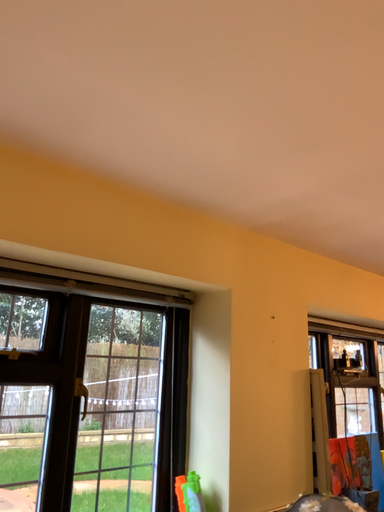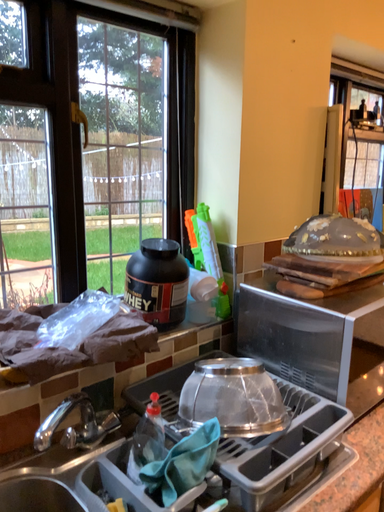
Question: Which way did the camera rotate in the video?

Choices:
 (A) rotated downward
 (B) rotated upward

Answer: (A)